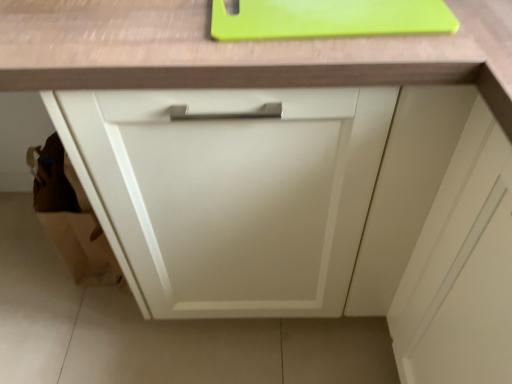
Question: Considering their positions, is green plastic cutting board at upper center located in front of or behind matte white cabinet at center?

Choices:
 (A) behind
 (B) front

Answer: (A)

Question: Based on their sizes in the image, would you say green plastic cutting board at upper center is bigger or smaller than matte white cabinet at center?

Choices:
 (A) big
 (B) small

Answer: (B)

Question: Would you say green plastic cutting board at upper center is to the left or to the right of matte white cabinet at center in the picture?

Choices:
 (A) right
 (B) left

Answer: (A)

Question: Relative to green plastic cutting board at upper center, is matte white cabinet at center in front or behind?

Choices:
 (A) behind
 (B) front

Answer: (B)

Question: Considering the positions of point (170, 263) and point (417, 6), is point (170, 263) closer or farther from the camera than point (417, 6)?

Choices:
 (A) farther
 (B) closer

Answer: (A)

Question: From a real-world perspective, is matte white cabinet at center physically located above or below green plastic cutting board at upper center?

Choices:
 (A) below
 (B) above

Answer: (A)

Question: Considering the positions of matte white cabinet at center and green plastic cutting board at upper center in the image, is matte white cabinet at center taller or shorter than green plastic cutting board at upper center?

Choices:
 (A) short
 (B) tall

Answer: (B)